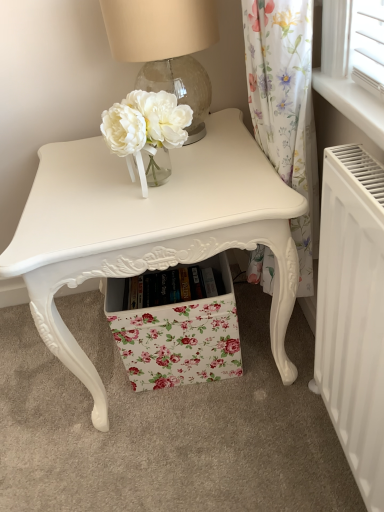
Question: In the image, is floral fabric drawer at center positioned in front of or behind white matte radiator at lower right?

Choices:
 (A) behind
 (B) front

Answer: (A)

Question: Considering the positions of floral fabric drawer at center and white matte radiator at lower right in the image, is floral fabric drawer at center taller or shorter than white matte radiator at lower right?

Choices:
 (A) tall
 (B) short

Answer: (B)

Question: Based on their relative distances, which object is nearer to the floral fabric drawer at center?

Choices:
 (A) white matte radiator at lower right
 (B) matte white table at center
 (C) translucent glass table lamp at upper center

Answer: (B)

Question: Which is nearer to the translucent glass table lamp at upper center?

Choices:
 (A) floral fabric drawer at center
 (B) white matte radiator at lower right
 (C) matte white table at center

Answer: (C)